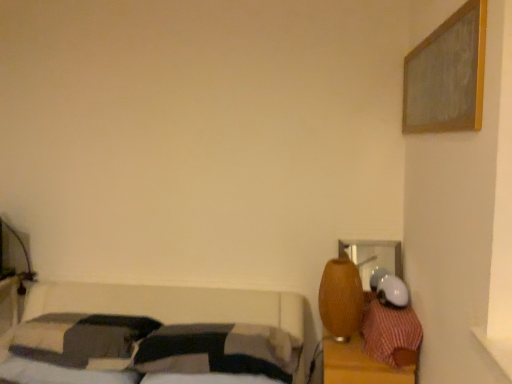
Image resolution: width=512 pixels, height=384 pixels. I want to click on free spot above red plaid pillow at right, marked as the 3th pillow in a left-to-right arrangement (from a real-world perspective), so click(x=394, y=317).